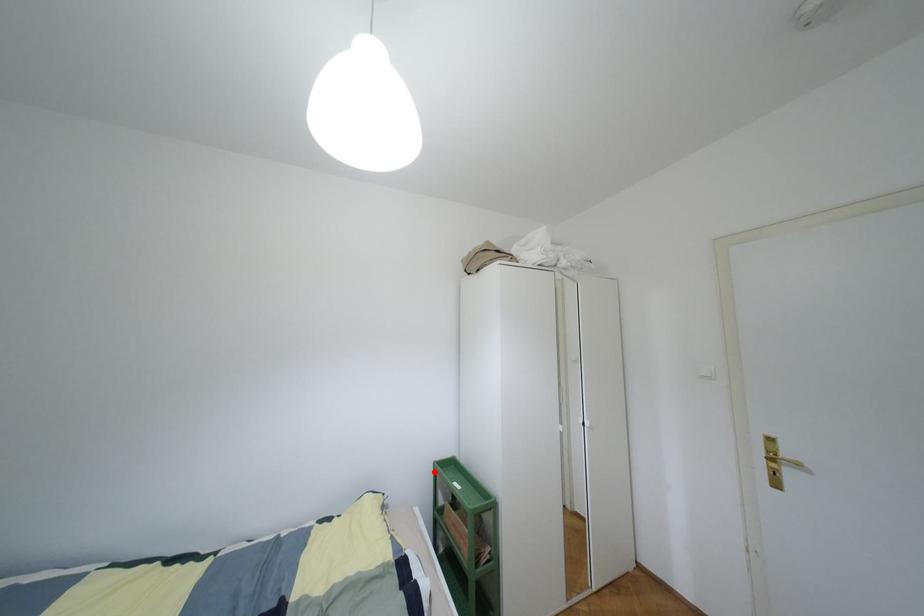
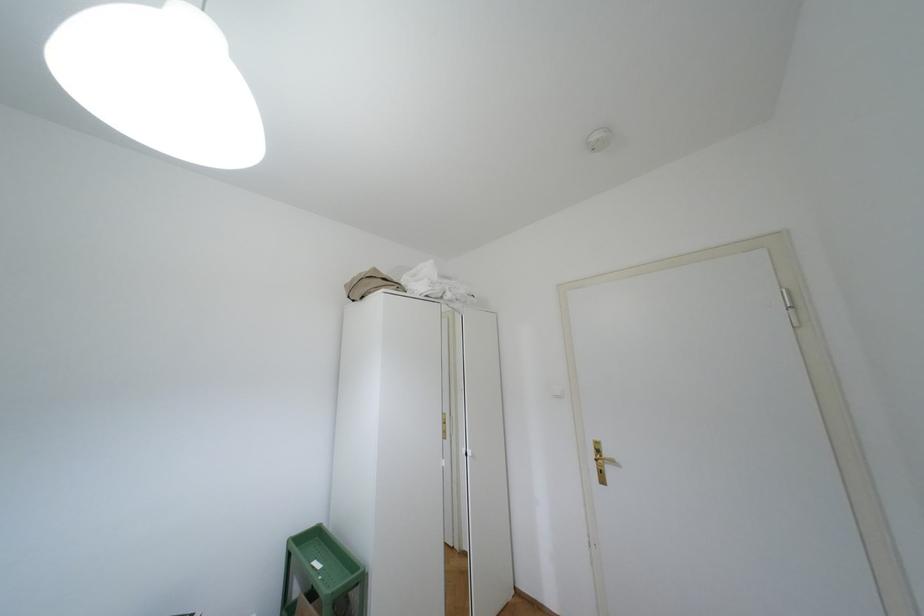
Where in the second image is the point corresponding to the highlighted location from the first image?

(288, 553)